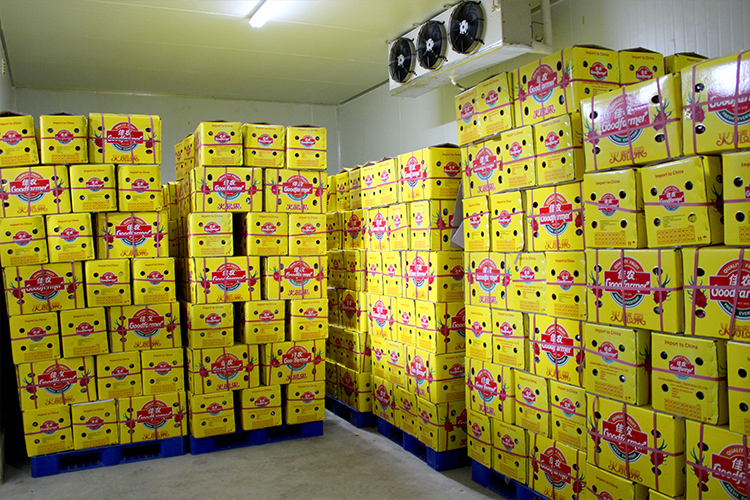
Identify the location of corners of the room. (344, 105), (7, 88).